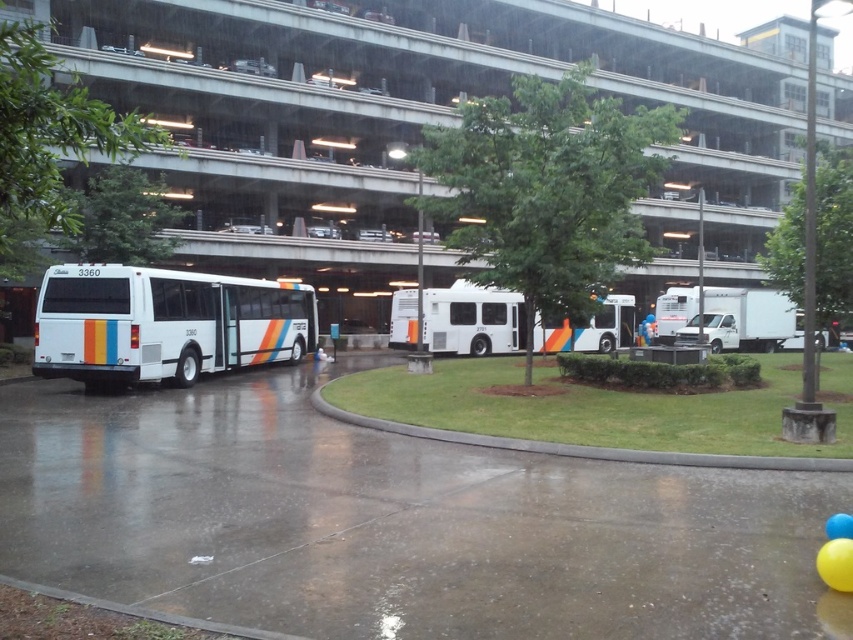
Is white glossy bus at left taller than white matte bus at center?

Indeed, white glossy bus at left has a greater height compared to white matte bus at center.

Image resolution: width=853 pixels, height=640 pixels. In order to click on white glossy bus at left in this screenshot , I will do `click(164, 323)`.

Locate an element on the screen. The height and width of the screenshot is (640, 853). white glossy bus at left is located at coordinates (164, 323).

Which of these two, white matte bus at center or yellow rubber balloon at lower right, stands taller?

Standing taller between the two is white matte bus at center.

Identify the location of white matte bus at center. The width and height of the screenshot is (853, 640). (473, 320).

Find the location of a particular element. Image resolution: width=853 pixels, height=640 pixels. white matte bus at center is located at coordinates (473, 320).

How much distance is there between green grass at lower center and yellow rubber balloon at lower right?

green grass at lower center is 16.59 feet away from yellow rubber balloon at lower right.

Image resolution: width=853 pixels, height=640 pixels. Describe the element at coordinates (578, 444) in the screenshot. I see `green grass at lower center` at that location.

Between point (341, 376) and point (817, 572), which one is positioned behind?

Positioned behind is point (341, 376).

You are a GUI agent. You are given a task and a screenshot of the screen. Output one action in this format:
    pyautogui.click(x=<x>, y=<y>)
    Task: Click on the green grass at lower center
    
    Given the screenshot: What is the action you would take?
    pyautogui.click(x=578, y=444)